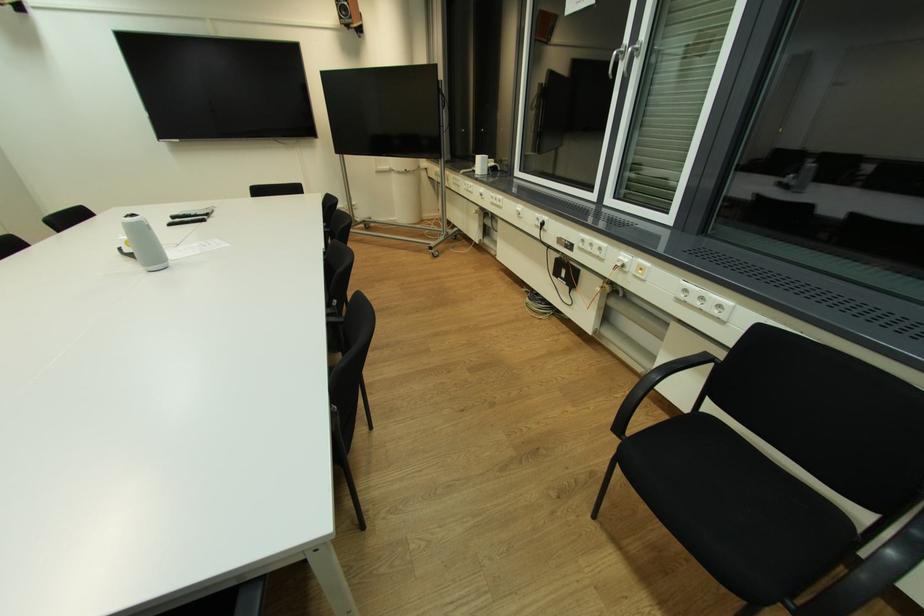
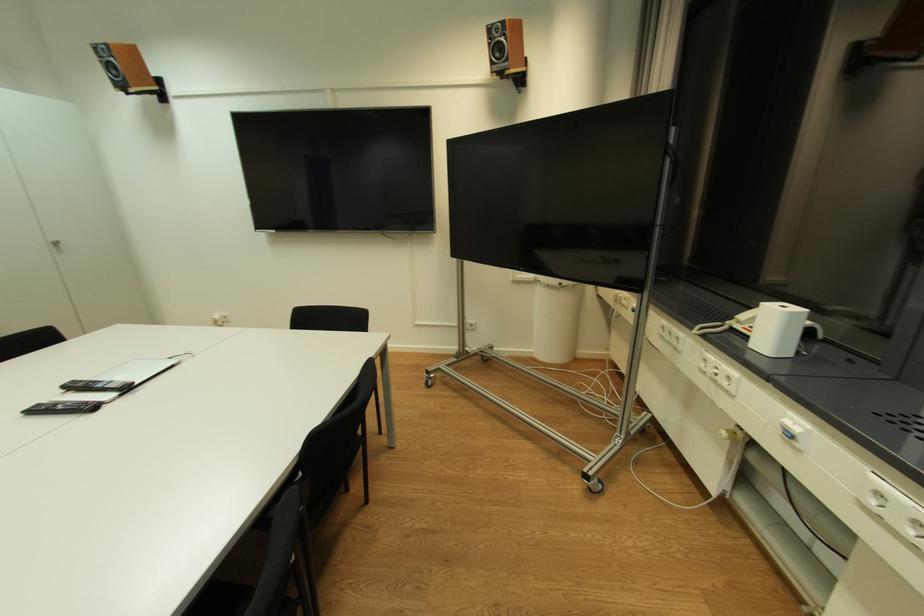
Question: Which direction would the cameraman need to move to produce the second image? Reply with the corresponding letter.

Choices:
 (A) Left
 (B) Right
 (C) Forward
 (D) Backward

Answer: (C)